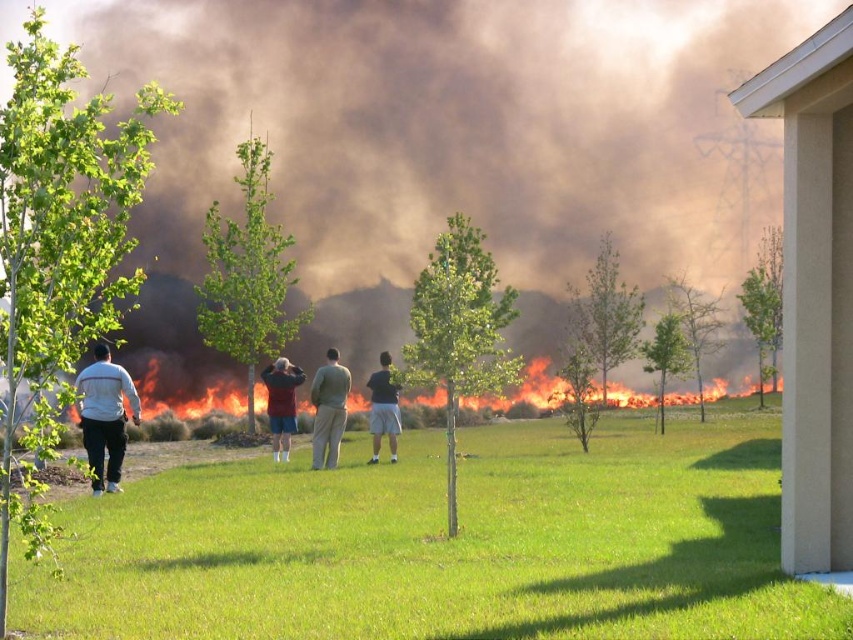
Is point (221, 406) less distant than point (318, 369)?

No, (221, 406) is behind (318, 369).

Can you confirm if flaming orange flames at center is positioned to the left of tan pants at center?

No, flaming orange flames at center is not to the left of tan pants at center.

This screenshot has height=640, width=853. I want to click on flaming orange flames at center, so click(x=711, y=394).

Can you confirm if green grass at center is positioned above flaming orange flames at center?

No, green grass at center is not above flaming orange flames at center.

Describe the element at coordinates (445, 545) in the screenshot. I see `green grass at center` at that location.

This screenshot has height=640, width=853. I want to click on green grass at center, so click(x=445, y=545).

Can you confirm if brown smoke at center is shorter than maroon fabric shirt at center?

No, brown smoke at center is not shorter than maroon fabric shirt at center.

Is brown smoke at center above maroon fabric shirt at center?

Indeed, brown smoke at center is positioned over maroon fabric shirt at center.

The image size is (853, 640). Describe the element at coordinates (450, 124) in the screenshot. I see `brown smoke at center` at that location.

Where is `brown smoke at center`? This screenshot has height=640, width=853. brown smoke at center is located at coordinates (450, 124).